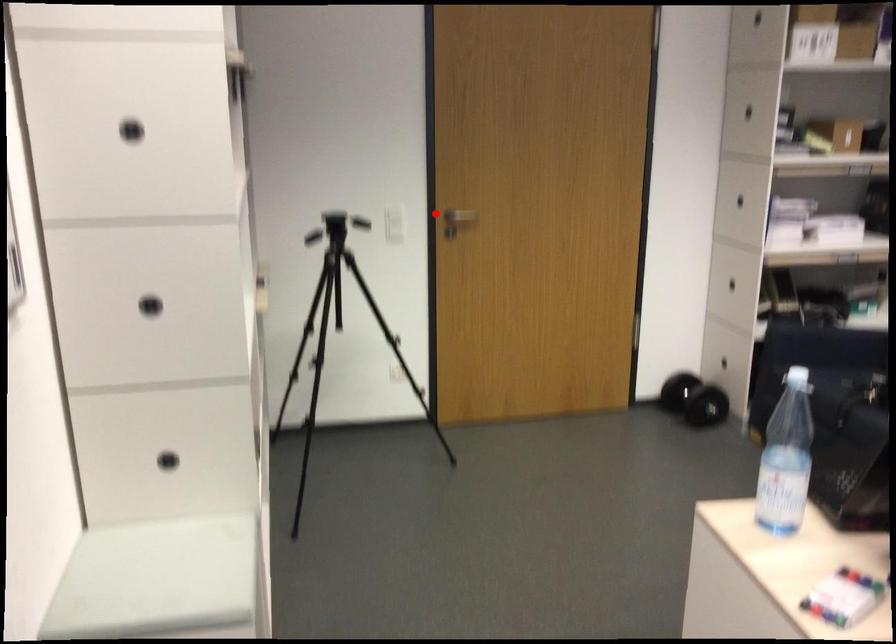
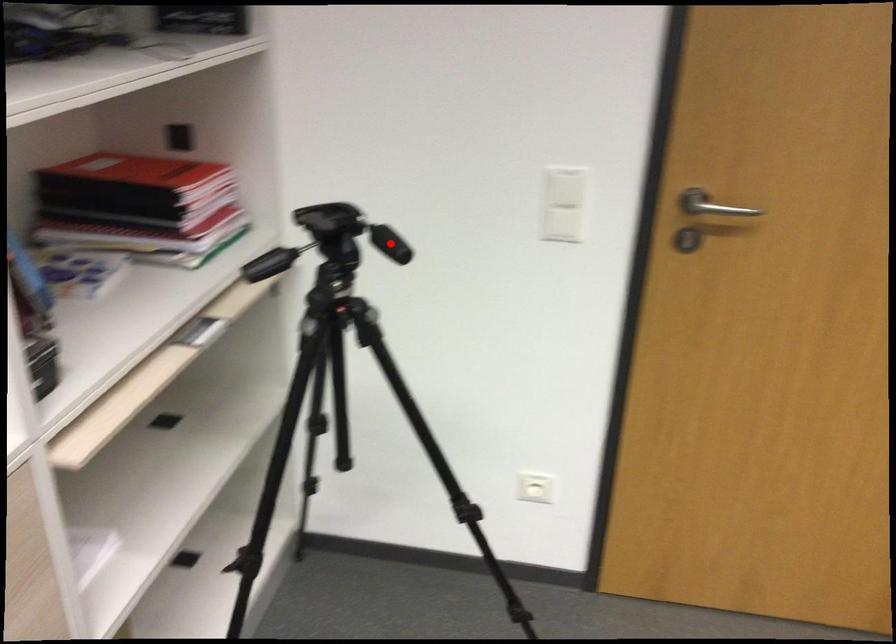
I am providing you with two images of the same scene from different viewpoints. A red point is marked on the first image and another point is marked on the second image. Is the red point in image1 aligned with the point shown in image2?

No